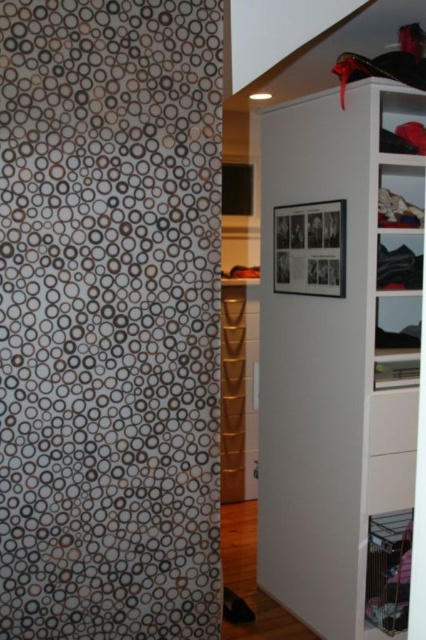
You are organizing a space and need to place a new decorative item between the white matte shower curtain at left and the white matte cabinet at upper right. Based on their positions, where should you place the item to ensure it is centered between them?

The white matte shower curtain at left is to the left of white matte cabinet at upper right, so placing the item halfway between them would center it between the two objects.

You are organizing items in the room and need to place a new decorative item. If you want to place it between the white matte shower curtain at left and the white matte cabinet at upper right, where should you place it relative to the shower curtain?

The white matte shower curtain at left is located above the white matte cabinet at upper right. Therefore, placing the decorative item between them would require positioning it below the shower curtain but above the cabinet.